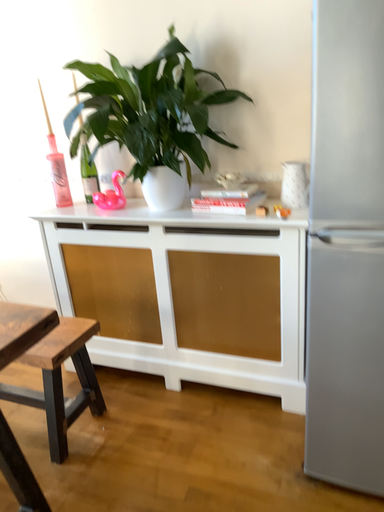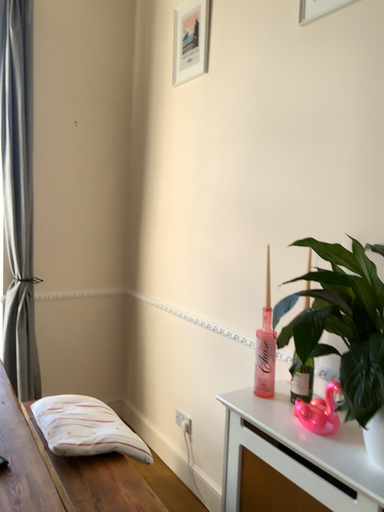
Question: Which way did the camera rotate in the video?

Choices:
 (A) rotated downward
 (B) rotated upward

Answer: (B)